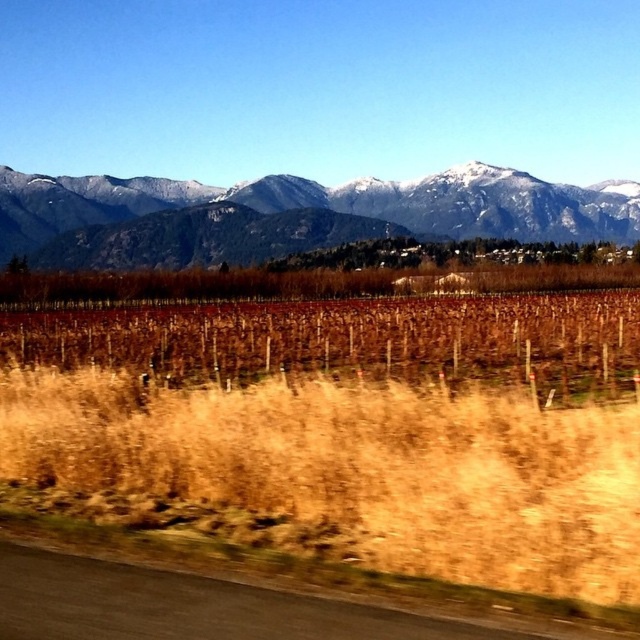
In the scene shown: Is dry grass at lower center below black asphalt road at lower left?

Incorrect, dry grass at lower center is not positioned below black asphalt road at lower left.

Looking at this image, is dry grass at lower center to the left of black asphalt road at lower left from the viewer's perspective?

Yes, dry grass at lower center is to the left of black asphalt road at lower left.

Is point (212, 324) positioned in front of point (275, 595)?

No, it is not.

At what (x,y) coordinates should I click in order to perform the action: click on dry grass at lower center. Please return your answer as a coordinate pair (x, y). The image size is (640, 640). Looking at the image, I should click on (356, 424).

Is dry grass at lower center thinner than snowy rocky mountains at upper center?

Yes, dry grass at lower center is thinner than snowy rocky mountains at upper center.

Looking at this image, which is more to the right, dry grass at lower center or snowy rocky mountains at upper center?

snowy rocky mountains at upper center is more to the right.

Which is behind, point (65, 460) or point (291, 179)?

The point (291, 179) is behind.

At what (x,y) coordinates should I click in order to perform the action: click on dry grass at lower center. Please return your answer as a coordinate pair (x, y). This screenshot has width=640, height=640. Looking at the image, I should click on (356, 424).

Is point (500, 214) closer to camera compared to point (224, 625)?

No, (500, 214) is further to viewer.

Who is higher up, snowy rocky mountains at upper center or black asphalt road at lower left?

snowy rocky mountains at upper center

Between point (388, 188) and point (451, 621), which one is positioned in front?

Point (451, 621) is in front.

Identify the location of snowy rocky mountains at upper center. (300, 212).